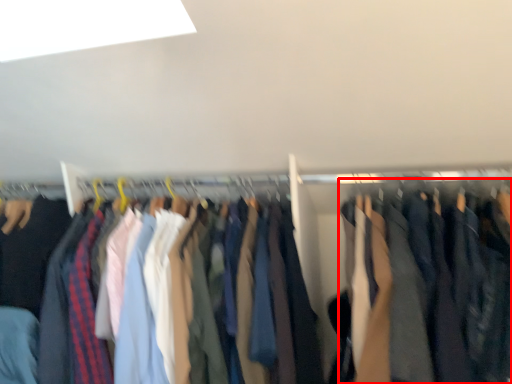
Question: From the image's perspective, what is the correct spatial relationship of clothing (annotated by the red box) in relation to trousers?

Choices:
 (A) below
 (B) above

Answer: (B)